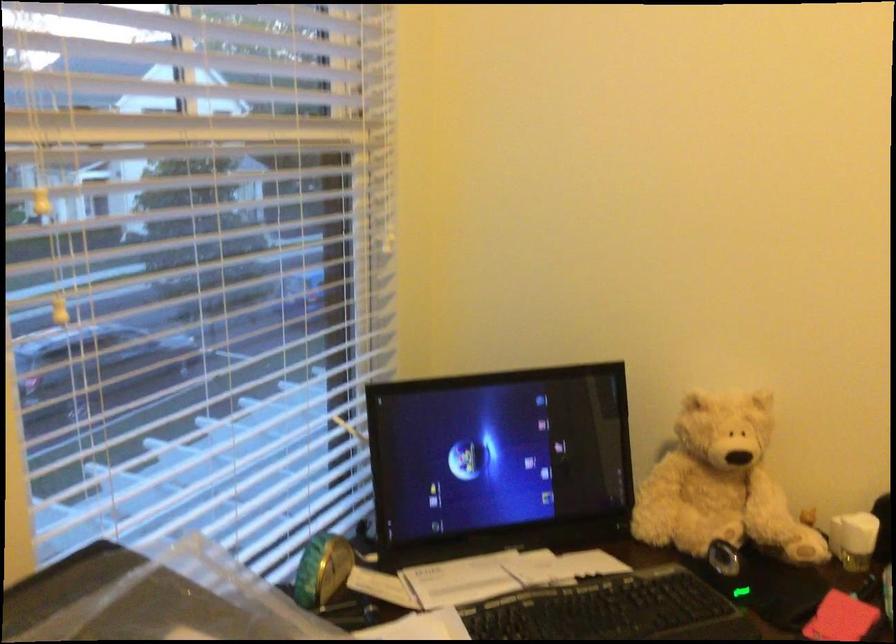
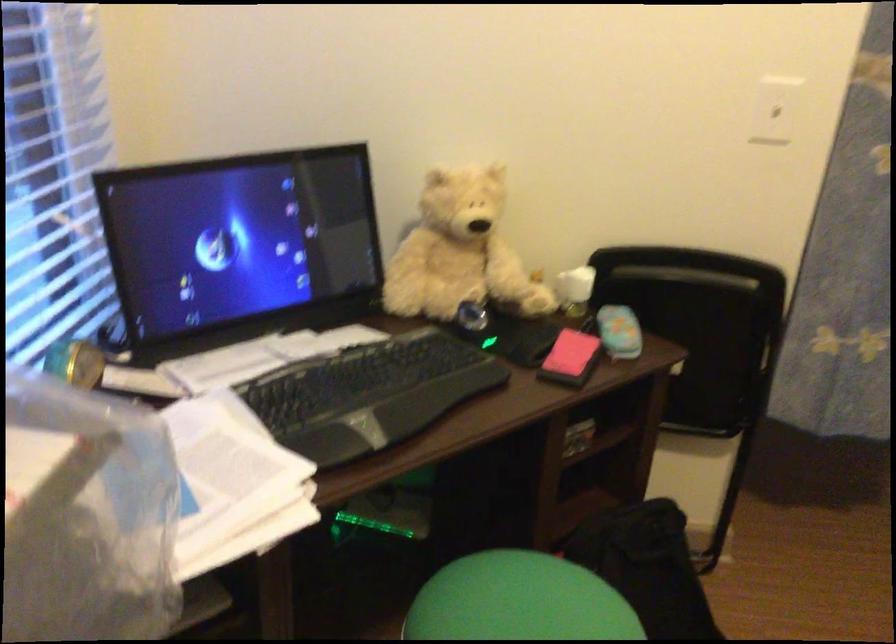
Question: Which direction would the cameraman need to move to produce the second image? Reply with the corresponding letter.

Choices:
 (A) Left
 (B) Right
 (C) Forward
 (D) Backward

Answer: (A)